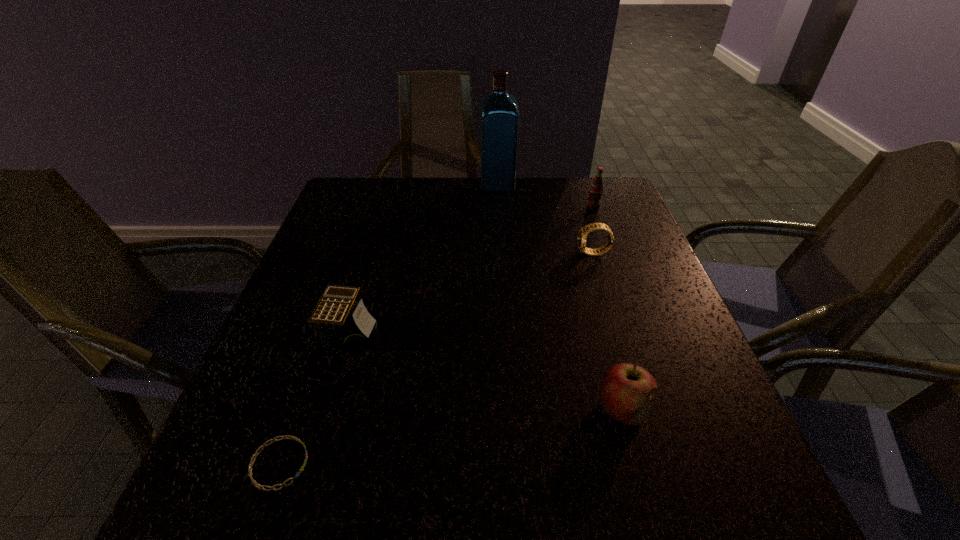
In the image, there is a desktop. At what (x,y) coordinates should I click in order to perform the action: click on vacant space at the near edge. Please return your answer as a coordinate pair (x, y). This screenshot has height=540, width=960. Looking at the image, I should click on (422, 516).

Identify the location of vacant area at the left edge. Image resolution: width=960 pixels, height=540 pixels. (279, 340).

In the image, there is a desktop. Where is `blank space at the right edge`? This screenshot has height=540, width=960. blank space at the right edge is located at coordinates (649, 423).

The image size is (960, 540). I want to click on free location at the near left corner, so click(205, 485).

Find the location of a particular element. This screenshot has height=540, width=960. free area in between the fourth nearest object and the apple is located at coordinates (608, 331).

Image resolution: width=960 pixels, height=540 pixels. I want to click on free space between the bracelet and the soda, so click(436, 335).

Where is `free space between the second nearest object and the tallest object`? This screenshot has width=960, height=540. free space between the second nearest object and the tallest object is located at coordinates (560, 297).

Where is `free space between the calculator and the apple`? The image size is (960, 540). free space between the calculator and the apple is located at coordinates (487, 372).

Find the location of `vacant space that is in between the fourth nearest object and the shortest object`. vacant space that is in between the fourth nearest object and the shortest object is located at coordinates (437, 359).

Image resolution: width=960 pixels, height=540 pixels. What are the coordinates of `free area in between the farthest object and the calculator` in the screenshot? It's located at (424, 260).